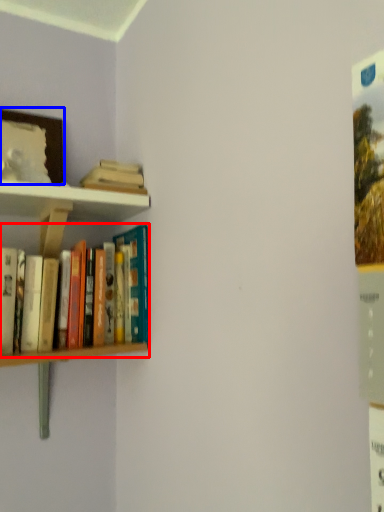
Question: Among these objects, which one is farthest to the camera, book (highlighted by a red box) or picture frame (highlighted by a blue box)?

Choices:
 (A) book
 (B) picture frame

Answer: (B)